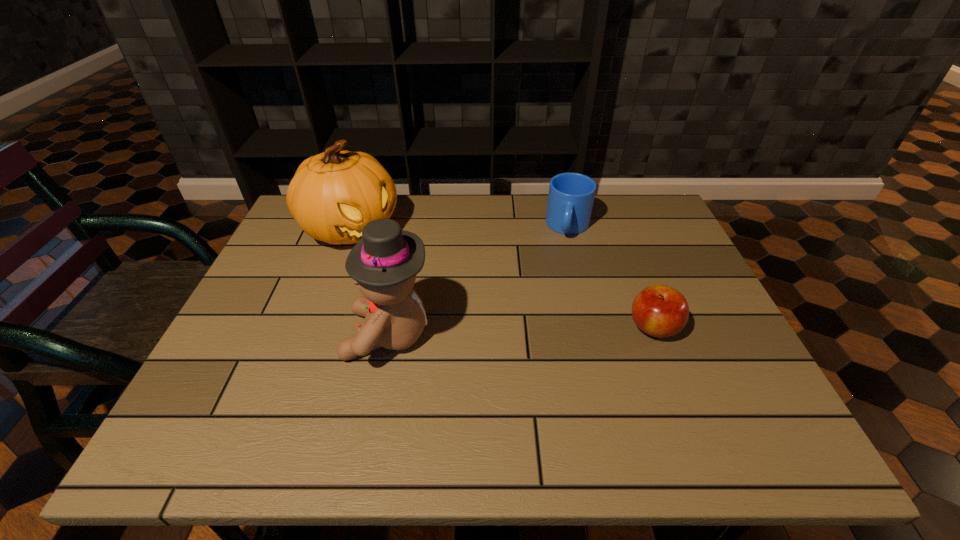
The height and width of the screenshot is (540, 960). I want to click on unoccupied area between the rag_doll and the shortest object, so point(521,331).

Locate an element on the screen. The width and height of the screenshot is (960, 540). free area in between the apple and the second object from right to left is located at coordinates (611, 277).

Where is `vacant region between the pumpkin and the shortest object`? Image resolution: width=960 pixels, height=540 pixels. vacant region between the pumpkin and the shortest object is located at coordinates (502, 278).

Locate an element on the screen. free area in between the mug and the apple is located at coordinates pyautogui.click(x=611, y=277).

What are the coordinates of `free point between the mug and the rag_doll` in the screenshot? It's located at (479, 281).

This screenshot has width=960, height=540. Find the location of `vacant space in between the third tallest object and the pumpkin`. vacant space in between the third tallest object and the pumpkin is located at coordinates (460, 227).

The image size is (960, 540). Find the location of `vacant space in between the apple and the rag_doll`. vacant space in between the apple and the rag_doll is located at coordinates (521, 331).

You are a GUI agent. You are given a task and a screenshot of the screen. Output one action in this format:
    pyautogui.click(x=<x>, y=<y>)
    Task: Click on the free space that is in between the third object from left to right and the pumpkin
    
    Given the screenshot: What is the action you would take?
    pyautogui.click(x=460, y=227)

The image size is (960, 540). Find the location of `free spot between the rag_doll and the rightmost object`. free spot between the rag_doll and the rightmost object is located at coordinates (521, 331).

Where is `object that stands as the closest to the pumpkin`? object that stands as the closest to the pumpkin is located at coordinates (384, 263).